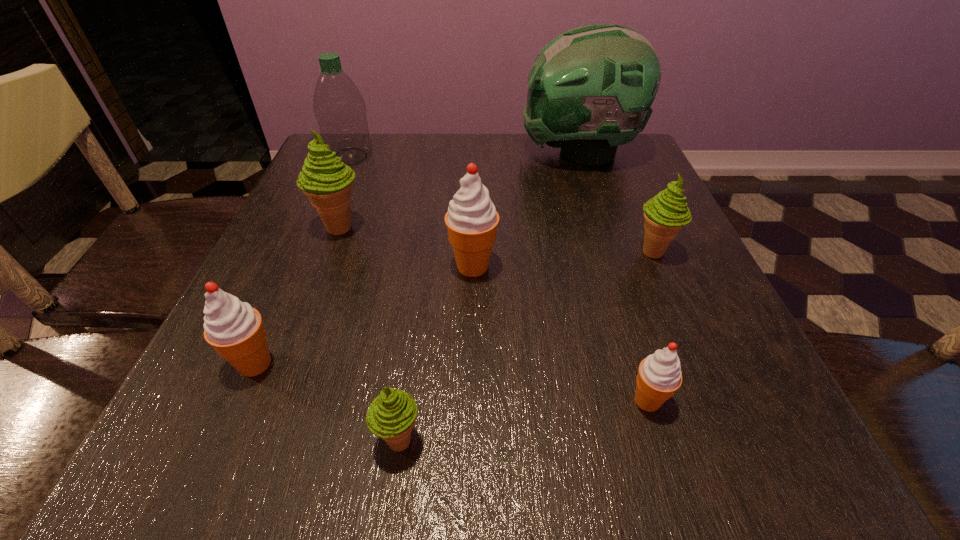
At what (x,y) coordinates should I click in order to perform the action: click on free space between the second biggest green icecream and the farthest red icecream. Please return your answer as a coordinate pair (x, y). This screenshot has width=960, height=540. Looking at the image, I should click on (564, 259).

Find the location of `vacant space that is in between the smallest red icecream and the second biggest green icecream`. vacant space that is in between the smallest red icecream and the second biggest green icecream is located at coordinates (651, 326).

Find the location of a particular element. vacant space that's between the leftmost red icecream and the green water bottle is located at coordinates (302, 260).

What are the coordinates of `empty location between the tallest object and the fourth object from right to left` in the screenshot? It's located at (526, 210).

Where is `free space that is in between the smallest green icecream and the second smallest red icecream`? The height and width of the screenshot is (540, 960). free space that is in between the smallest green icecream and the second smallest red icecream is located at coordinates (327, 402).

Where is `object that is the closest one to the leftmost green icecream`? object that is the closest one to the leftmost green icecream is located at coordinates (472, 220).

Select which object appears as the closest to the second biggest red icecream. Please provide its 2D coordinates. Your answer should be formatted as a tuple, i.e. [(x, y)], where the tuple contains the x and y coordinates of a point satisfying the conditions above.

[(391, 415)]

Locate an element on the screen. icecream that is the fifth closest to the leftmost green icecream is located at coordinates (659, 376).

What are the coordinates of `the closest icecream to the green water bottle` in the screenshot? It's located at (325, 179).

Locate which green icecream ranks second in proximity to the nearest green icecream. Please provide its 2D coordinates. Your answer should be formatted as a tuple, i.e. [(x, y)], where the tuple contains the x and y coordinates of a point satisfying the conditions above.

[(665, 214)]